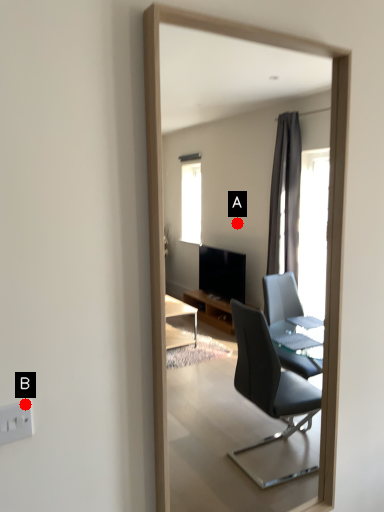
Question: Two points are circled on the image, labeled by A and B beside each circle. Which point is farther to the camera?

Choices:
 (A) A is further
 (B) B is further

Answer: (A)